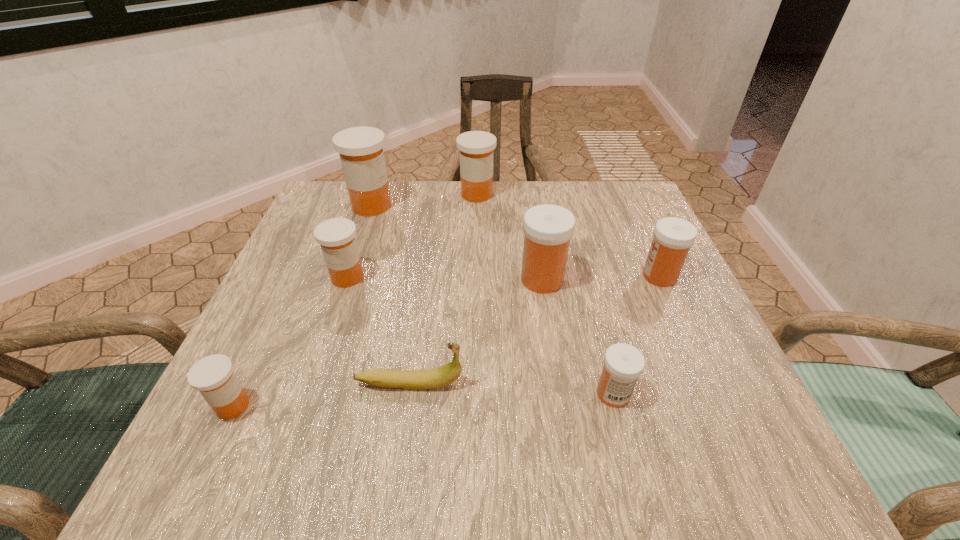
In the image, there is a desktop. Where is `vacant space at the far right corner`? vacant space at the far right corner is located at coordinates (642, 212).

The height and width of the screenshot is (540, 960). What are the coordinates of `free spot between the tallest object and the second smallest white medicine` in the screenshot? It's located at (516, 241).

At what (x,y) coordinates should I click in order to perform the action: click on free spot between the rightmost white medicine and the banana. Please return your answer as a coordinate pair (x, y). Looking at the image, I should click on (535, 329).

The height and width of the screenshot is (540, 960). I want to click on free space between the nearest orange medicine and the biggest white medicine, so click(x=387, y=342).

Where is `vacant area that lies between the leftmost object and the fourth medicine from right to left`? The width and height of the screenshot is (960, 540). vacant area that lies between the leftmost object and the fourth medicine from right to left is located at coordinates (354, 300).

In order to click on blank region between the third farthest orange medicine and the biggest orange medicine in this screenshot , I will do `click(359, 241)`.

Find the location of a particular element. This screenshot has width=960, height=540. free spot between the banana and the second biggest white medicine is located at coordinates (535, 329).

Locate an element on the screen. The width and height of the screenshot is (960, 540). free space between the biggest orange medicine and the third medicine from right to left is located at coordinates (457, 242).

I want to click on vacant area that lies between the second nearest orange medicine and the rightmost orange medicine, so click(x=412, y=236).

Find the location of a particular element. Image resolution: width=960 pixels, height=540 pixels. vacant area between the rightmost orange medicine and the smallest orange medicine is located at coordinates (354, 300).